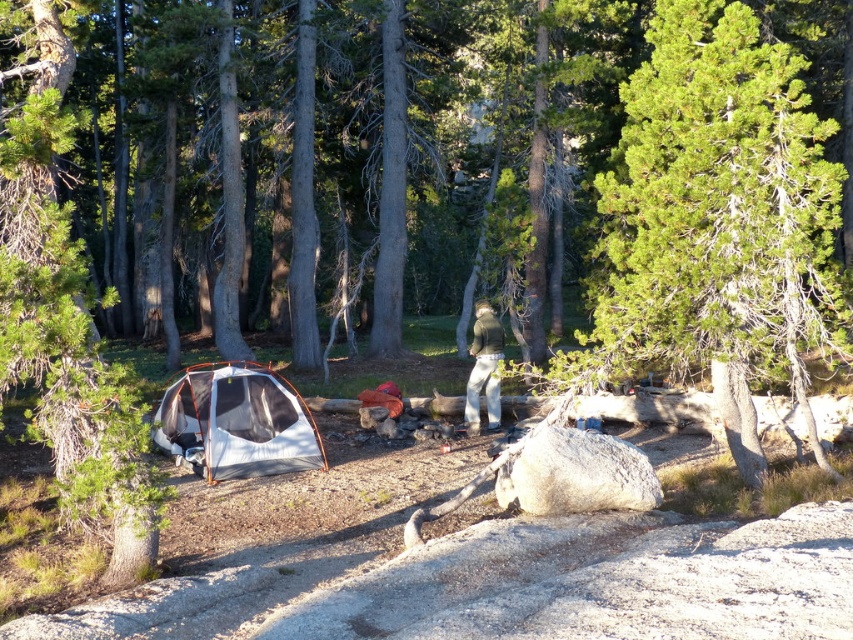
You are a hiker who just arrived at the campsite and wants to put on your green fuzzy sweater at center before it gets chilly. However, you are currently standing next to the green textured tent at lower left. Which object is closer to you so you can quickly grab your sweater?

The green textured tent at lower left is closer to you than the green fuzzy sweater at center, so you can reach it first before moving towards the sweater.